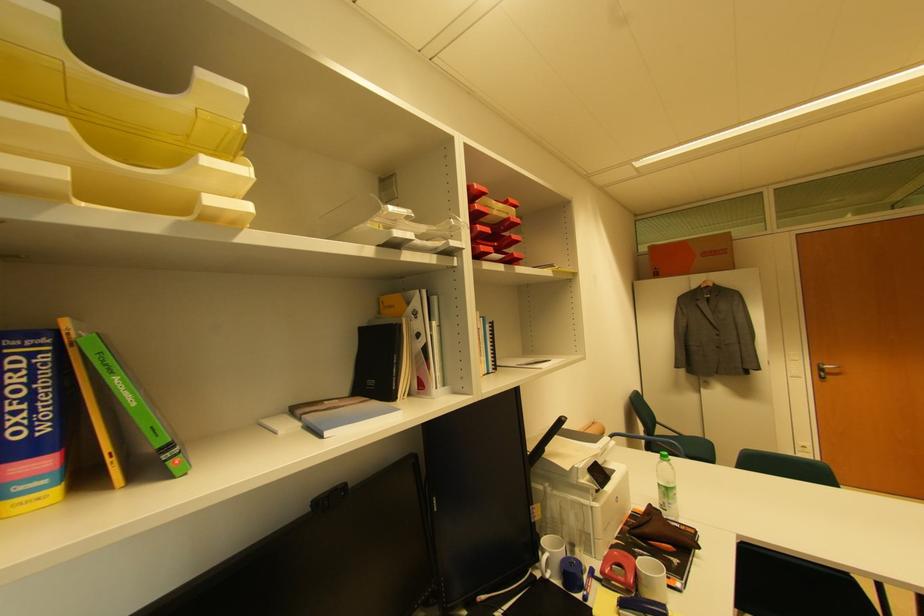
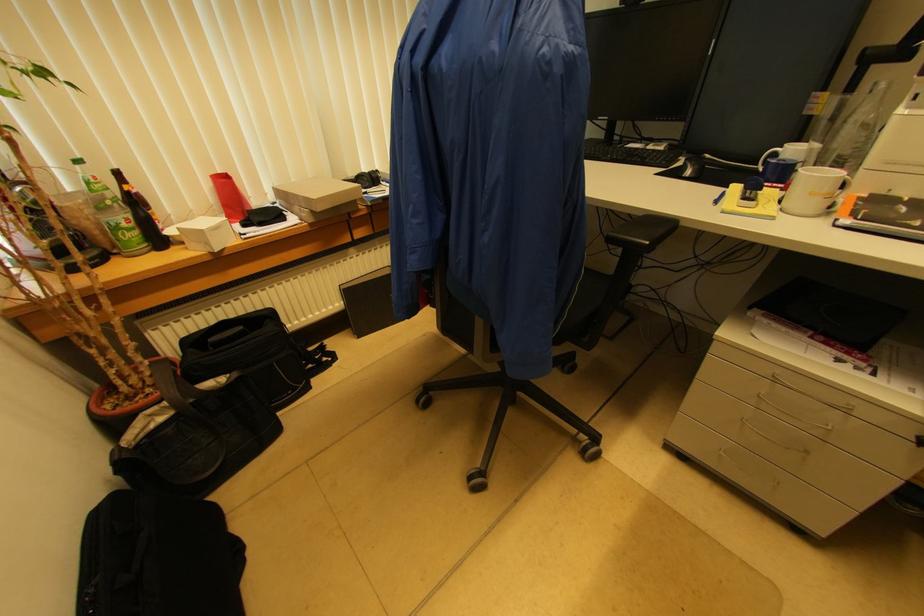
Find the pixel in the second image that matches point 549,562 in the first image.

(775, 156)